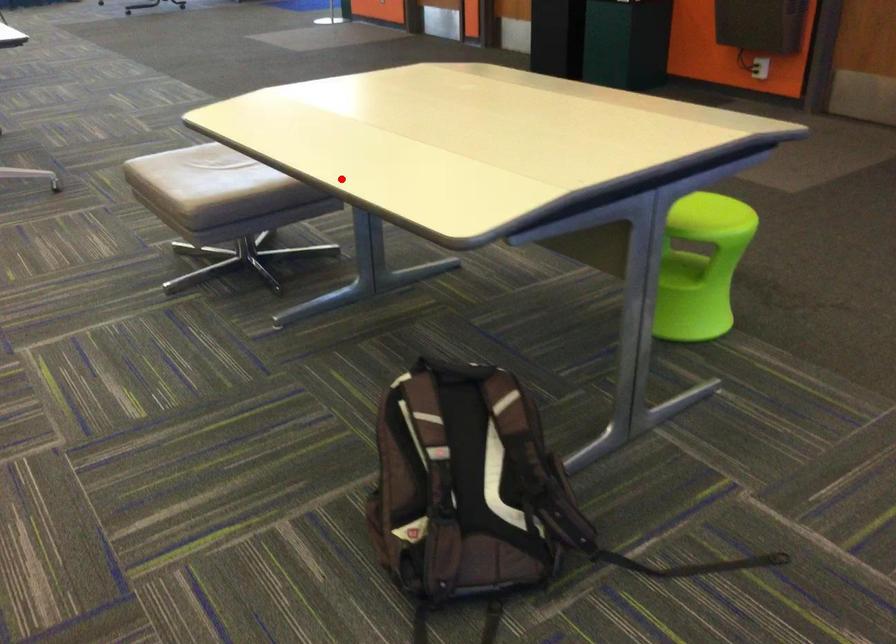
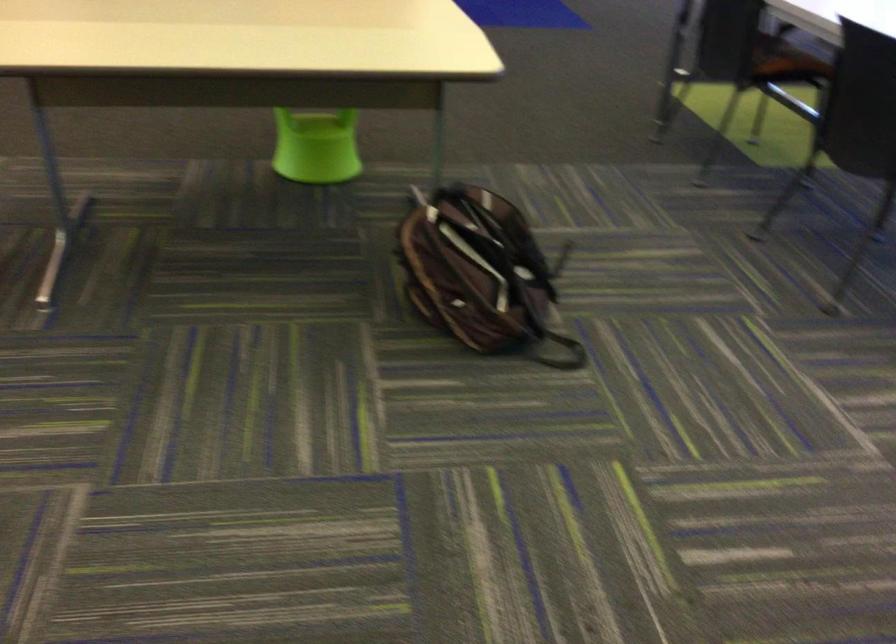
The point at the highlighted location is marked in the first image. Where is the corresponding point in the second image?

(322, 67)